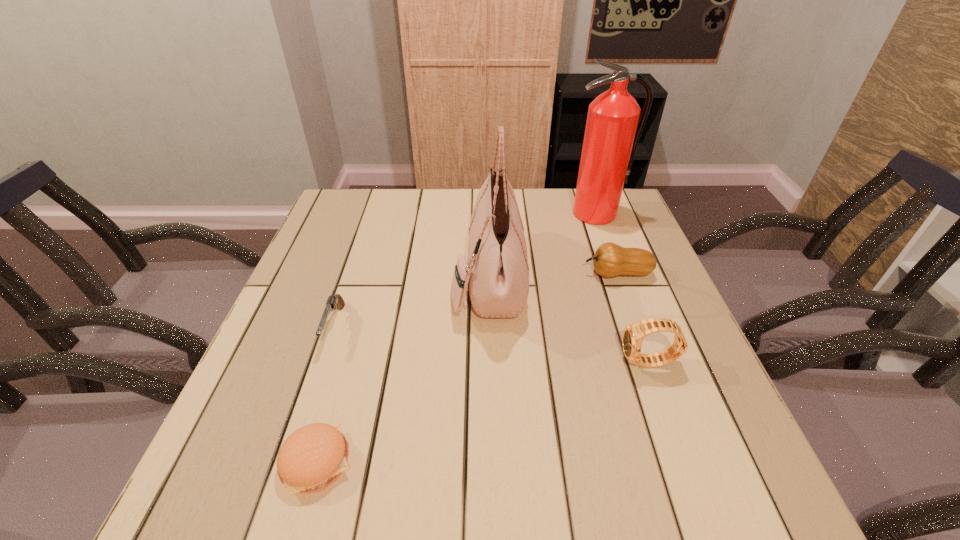
Where is `free location that satisfies the following two spatial constraints: 1. on the stem side of the gourd; 2. aiming along the barrel of the gun`? The width and height of the screenshot is (960, 540). free location that satisfies the following two spatial constraints: 1. on the stem side of the gourd; 2. aiming along the barrel of the gun is located at coordinates (636, 326).